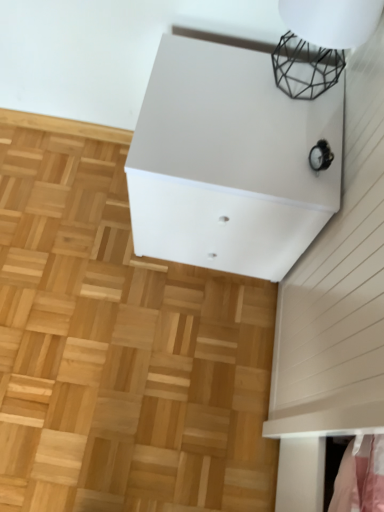
Question: Is black wire mesh at upper right at the left side of natural wood parquet floor at center?

Choices:
 (A) yes
 (B) no

Answer: (B)

Question: Are black wire mesh at upper right and natural wood parquet floor at center located far from each other?

Choices:
 (A) yes
 (B) no

Answer: (B)

Question: Is black wire mesh at upper right oriented away from natural wood parquet floor at center?

Choices:
 (A) yes
 (B) no

Answer: (B)

Question: Is black wire mesh at upper right outside of natural wood parquet floor at center?

Choices:
 (A) no
 (B) yes

Answer: (B)

Question: From a real-world perspective, is black wire mesh at upper right on natural wood parquet floor at center?

Choices:
 (A) yes
 (B) no

Answer: (A)

Question: From the image's perspective, is black wire mesh at upper right above natural wood parquet floor at center?

Choices:
 (A) no
 (B) yes

Answer: (B)

Question: From the image's perspective, is white matte cabinet at upper center above natural wood parquet floor at center?

Choices:
 (A) yes
 (B) no

Answer: (A)

Question: Does white matte cabinet at upper center have a greater width compared to natural wood parquet floor at center?

Choices:
 (A) no
 (B) yes

Answer: (A)

Question: Is white matte cabinet at upper center taller than natural wood parquet floor at center?

Choices:
 (A) yes
 (B) no

Answer: (A)

Question: Does white matte cabinet at upper center have a lesser width compared to natural wood parquet floor at center?

Choices:
 (A) no
 (B) yes

Answer: (B)

Question: Considering the relative positions of white matte cabinet at upper center and natural wood parquet floor at center in the image provided, is white matte cabinet at upper center in front of natural wood parquet floor at center?

Choices:
 (A) yes
 (B) no

Answer: (A)

Question: Are white matte cabinet at upper center and natural wood parquet floor at center located far from each other?

Choices:
 (A) yes
 (B) no

Answer: (B)

Question: Does white matte cabinet at upper center touch black wire mesh at upper right?

Choices:
 (A) no
 (B) yes

Answer: (A)